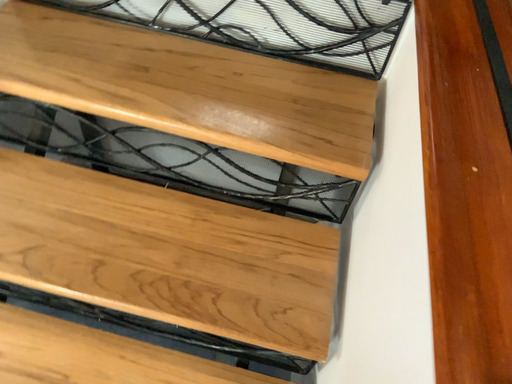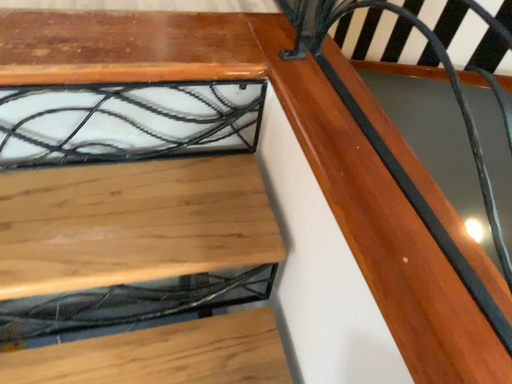
Question: Which way did the camera rotate in the video?

Choices:
 (A) rotated left
 (B) rotated right

Answer: (B)